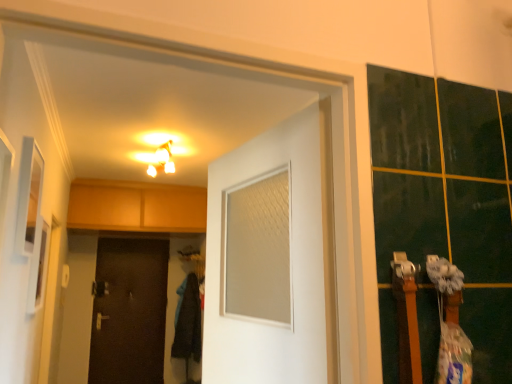
Question: Is white matte door at center, which is counted as the first door, starting from the front, oriented away from matte white light fixture at upper center?

Choices:
 (A) no
 (B) yes

Answer: (A)

Question: Can matte white light fixture at upper center be found inside white matte door at center, which appears as the 2th door when ordered from the bottom?

Choices:
 (A) no
 (B) yes

Answer: (A)

Question: Does white matte door at center, which appears as the 2th door when ordered from the bottom, have a lesser width compared to matte white light fixture at upper center?

Choices:
 (A) no
 (B) yes

Answer: (B)

Question: From a real-world perspective, is white matte door at center, which appears as the 2th door when ordered from the bottom, physically below matte white light fixture at upper center?

Choices:
 (A) yes
 (B) no

Answer: (A)

Question: Is white matte door at center, which is the 1th door from top to bottom, to the right of matte white light fixture at upper center from the viewer's perspective?

Choices:
 (A) no
 (B) yes

Answer: (B)

Question: Is white matte door at center, which is the 2th door in back-to-front order, inside or outside of brown matte door at lower left, the second door viewed from the top?

Choices:
 (A) inside
 (B) outside

Answer: (B)

Question: From a real-world perspective, is white matte door at center, which appears as the 2th door when ordered from the bottom, positioned above or below brown matte door at lower left, the 1th door positioned from the bottom?

Choices:
 (A) below
 (B) above

Answer: (B)

Question: From the image's perspective, is white matte door at center, which appears as the 2th door when ordered from the bottom, located above or below brown matte door at lower left, the second door viewed from the top?

Choices:
 (A) below
 (B) above

Answer: (B)

Question: Looking at their shapes, would you say white matte door at center, the second door when ordered from left to right, is wider or thinner than brown matte door at lower left, the 1th door positioned from the bottom?

Choices:
 (A) thin
 (B) wide

Answer: (B)

Question: From the image's perspective, relative to white matte door at center, the first door from the right, is matte white light fixture at upper center above or below?

Choices:
 (A) below
 (B) above

Answer: (B)

Question: In the image, is matte white light fixture at upper center on the left side or the right side of white matte door at center, the second door when ordered from left to right?

Choices:
 (A) right
 (B) left

Answer: (B)

Question: Is matte white light fixture at upper center taller or shorter than white matte door at center, which is counted as the first door, starting from the front?

Choices:
 (A) short
 (B) tall

Answer: (A)

Question: Is point (159, 162) closer or farther from the camera than point (318, 208)?

Choices:
 (A) farther
 (B) closer

Answer: (A)

Question: Is white matte door at center, which is counted as the first door, starting from the front, wider or thinner than matte white light fixture at upper center?

Choices:
 (A) thin
 (B) wide

Answer: (A)

Question: Is white matte door at center, which appears as the 2th door when ordered from the bottom, bigger or smaller than matte white light fixture at upper center?

Choices:
 (A) big
 (B) small

Answer: (A)